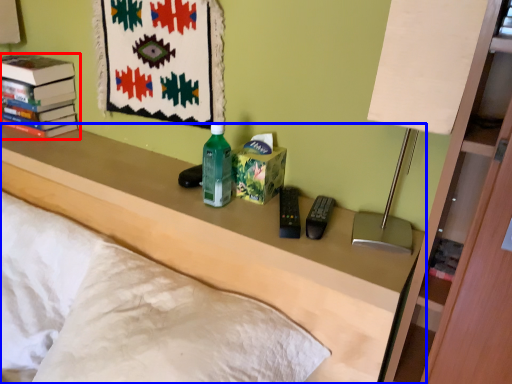
Question: Among these objects, which one is farthest to the camera, book (highlighted by a red box) or furniture (highlighted by a blue box)?

Choices:
 (A) book
 (B) furniture

Answer: (A)